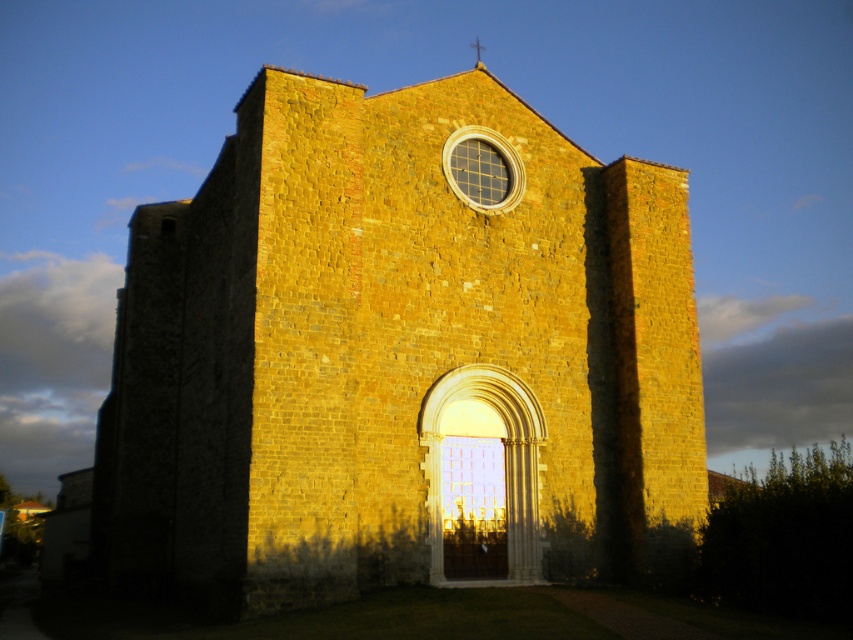
Which is below, yellow stone church at center or metallic cross at upper center?

yellow stone church at center

Who is positioned more to the left, yellow stone church at center or metallic cross at upper center?

yellow stone church at center is more to the left.

This screenshot has width=853, height=640. Identify the location of yellow stone church at center. (399, 355).

At what (x,y) coordinates should I click in order to perform the action: click on yellow stone church at center. Please return your answer as a coordinate pair (x, y). Image resolution: width=853 pixels, height=640 pixels. Looking at the image, I should click on (399, 355).